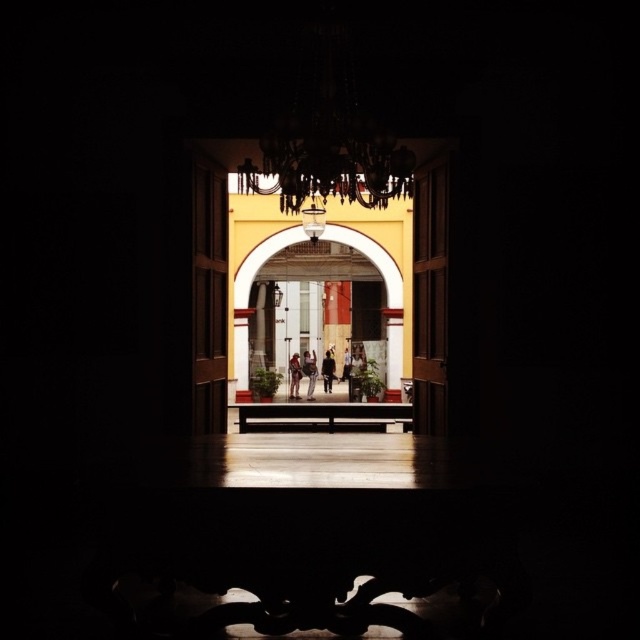
Between point (387, 300) and point (294, 362), which one is positioned behind?

The point (294, 362) is more distant.

Which is more to the right, white marble archway at center or matte black jacket at center?

white marble archway at center is more to the right.

Is point (246, 376) closer to viewer compared to point (291, 368)?

Yes, it is in front of point (291, 368).

Where is `white marble archway at center`? Image resolution: width=640 pixels, height=640 pixels. white marble archway at center is located at coordinates (371, 259).

Is silvery metallic chandelier at upper center below dark brown leather jacket at center?

Actually, silvery metallic chandelier at upper center is above dark brown leather jacket at center.

Is silvery metallic chandelier at upper center positioned before dark brown leather jacket at center?

That is True.

The width and height of the screenshot is (640, 640). What are the coordinates of `silvery metallic chandelier at upper center` in the screenshot? It's located at (328, 161).

Between point (324, 227) and point (310, 362), which one is positioned behind?

The point (310, 362) is more distant.

Between white marble archway at center and dark brown leather jacket at center, which one appears on the left side from the viewer's perspective?

dark brown leather jacket at center is more to the left.

Is point (353, 243) positioned before point (305, 369)?

Yes, it is in front of point (305, 369).

This screenshot has height=640, width=640. Identify the location of white marble archway at center. (371, 259).